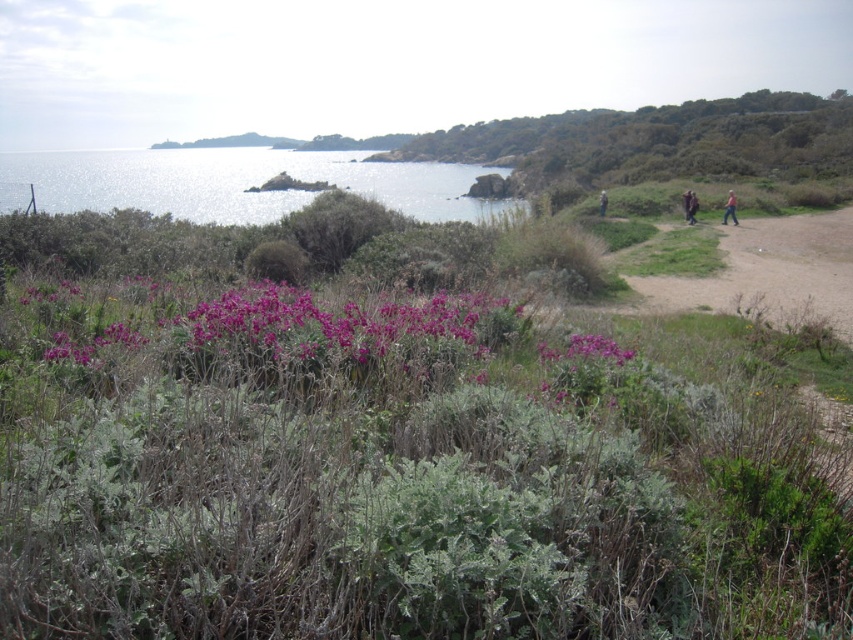
Question: Does brown woolen sweater at right appear on the left side of brown leather jacket at upper right?

Choices:
 (A) yes
 (B) no

Answer: (B)

Question: Which point is closer to the camera taking this photo?

Choices:
 (A) (260, 148)
 (B) (601, 209)
 (C) (728, 198)

Answer: (C)

Question: Is shiny metallic water at upper left further to the viewer compared to brown woolen sweater at right?

Choices:
 (A) yes
 (B) no

Answer: (B)

Question: Among these objects, which one is nearest to the camera?

Choices:
 (A) shiny metallic water at upper left
 (B) pink fabric at right
 (C) brown woolen sweater at right
 (D) brown leather jacket at upper right

Answer: (A)

Question: Estimate the real-world distances between objects in this image. Which object is closer to the brown leather jacket at upper right?

Choices:
 (A) pink fabric at right
 (B) shiny metallic water at upper left

Answer: (A)

Question: Is brown woolen sweater at right to the left of brown leather jacket at upper right from the viewer's perspective?

Choices:
 (A) yes
 (B) no

Answer: (B)